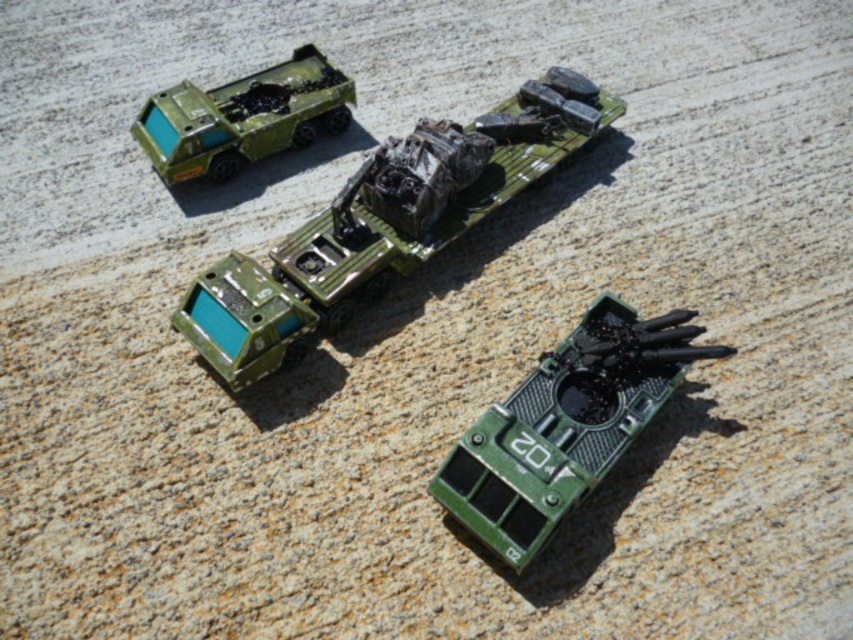
You are a toy collector arranging miniature military vehicles on a shelf. You have the matte green truck at center and the matte green plastic truck at upper left. Which truck should you place higher on the shelf to match their positions in the image?

The matte green plastic truck at upper left should be placed higher on the shelf since it is positioned above the matte green truck at center in the image.